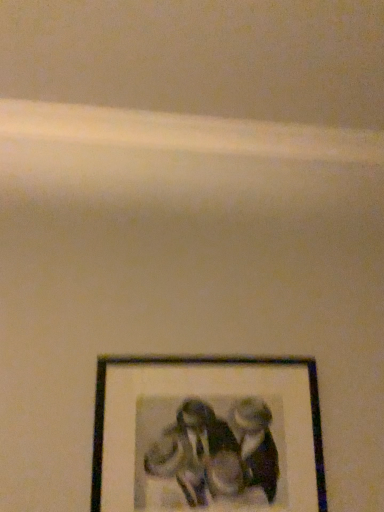
What do you see at coordinates (207, 435) in the screenshot?
I see `black matte picture frame at lower center` at bounding box center [207, 435].

Measure the distance between black matte picture frame at lower center and camera.

They are 3.31 feet apart.

Where is `black matte picture frame at lower center`? The image size is (384, 512). black matte picture frame at lower center is located at coordinates (207, 435).

I want to click on black matte picture frame at lower center, so click(207, 435).